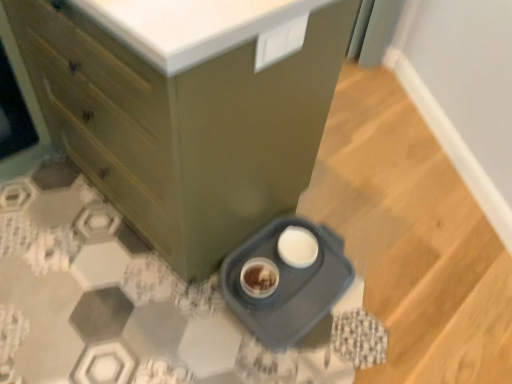
Locate an element on the screen. The image size is (512, 384). matte green cabinet at lower left is located at coordinates (187, 108).

The height and width of the screenshot is (384, 512). Describe the element at coordinates (187, 108) in the screenshot. I see `matte green cabinet at lower left` at that location.

This screenshot has width=512, height=384. What do you see at coordinates (287, 285) in the screenshot?
I see `gray plastic tray at lower center` at bounding box center [287, 285].

Where is `gray plastic tray at lower center`? This screenshot has width=512, height=384. gray plastic tray at lower center is located at coordinates (287, 285).

Measure the distance between point (321, 264) and camera.

The distance of point (321, 264) from camera is 1.49 meters.

Where is `matte green cabinet at lower left`? The height and width of the screenshot is (384, 512). matte green cabinet at lower left is located at coordinates (187, 108).

Based on the photo, is gray plastic tray at lower center at the left side of matte green cabinet at lower left?

In fact, gray plastic tray at lower center is to the right of matte green cabinet at lower left.

Relative to matte green cabinet at lower left, is gray plastic tray at lower center in front or behind?

In the image, gray plastic tray at lower center appears behind matte green cabinet at lower left.

Which is closer, (332,284) or (242,156)?

The point (242,156) is closer.

From the image's perspective, is gray plastic tray at lower center located beneath matte green cabinet at lower left?

Correct, gray plastic tray at lower center appears lower than matte green cabinet at lower left in the image.

From a real-world perspective, which object rests below the other?

From a 3D spatial view, gray plastic tray at lower center is below.

Looking at their sizes, would you say gray plastic tray at lower center is wider or thinner than matte green cabinet at lower left?

gray plastic tray at lower center is thinner than matte green cabinet at lower left.

In the scene shown: Considering the relative sizes of gray plastic tray at lower center and matte green cabinet at lower left in the image provided, is gray plastic tray at lower center taller than matte green cabinet at lower left?

Incorrect, the height of gray plastic tray at lower center is not larger of that of matte green cabinet at lower left.

Does gray plastic tray at lower center have a smaller size compared to matte green cabinet at lower left?

Indeed, gray plastic tray at lower center has a smaller size compared to matte green cabinet at lower left.

Could matte green cabinet at lower left be considered to be inside gray plastic tray at lower center?

Actually, matte green cabinet at lower left is outside gray plastic tray at lower center.

Is gray plastic tray at lower center not near matte green cabinet at lower left?

No, gray plastic tray at lower center is in close proximity to matte green cabinet at lower left.

Is gray plastic tray at lower center looking in the opposite direction of matte green cabinet at lower left?

Correct, gray plastic tray at lower center is looking away from matte green cabinet at lower left.

How many degrees apart are the facing directions of gray plastic tray at lower center and matte green cabinet at lower left?

The facing directions of gray plastic tray at lower center and matte green cabinet at lower left are 90.3 degrees apart.

Measure the distance between gray plastic tray at lower center and matte green cabinet at lower left.

gray plastic tray at lower center and matte green cabinet at lower left are 17.88 inches apart from each other.

Find the location of a particular element. This screenshot has width=512, height=384. appliance that appears behind the matte green cabinet at lower left is located at coordinates (287, 285).

Which is more to the right, matte green cabinet at lower left or gray plastic tray at lower center?

gray plastic tray at lower center is more to the right.

Does matte green cabinet at lower left come behind gray plastic tray at lower center?

No, it is not.

Is point (283, 127) more distant than point (293, 220)?

That is False.

From the picture: From the image's perspective, which is above, matte green cabinet at lower left or gray plastic tray at lower center?

matte green cabinet at lower left, from the image's perspective.

From a real-world perspective, who is located higher, matte green cabinet at lower left or gray plastic tray at lower center?

matte green cabinet at lower left, from a real-world perspective.

Considering the relative sizes of matte green cabinet at lower left and gray plastic tray at lower center in the image provided, is matte green cabinet at lower left wider than gray plastic tray at lower center?

Correct, the width of matte green cabinet at lower left exceeds that of gray plastic tray at lower center.

Between matte green cabinet at lower left and gray plastic tray at lower center, which one has more height?

With more height is matte green cabinet at lower left.

Considering the sizes of objects matte green cabinet at lower left and gray plastic tray at lower center in the image provided, who is smaller, matte green cabinet at lower left or gray plastic tray at lower center?

With smaller size is gray plastic tray at lower center.

Does matte green cabinet at lower left contain gray plastic tray at lower center?

No.

Is matte green cabinet at lower left directly adjacent to gray plastic tray at lower center?

No, matte green cabinet at lower left is not touching gray plastic tray at lower center.

Is matte green cabinet at lower left looking in the opposite direction of gray plastic tray at lower center?

No, matte green cabinet at lower left is not facing away from gray plastic tray at lower center.

Can you tell me how much matte green cabinet at lower left and gray plastic tray at lower center differ in facing direction?

The angle between the facing direction of matte green cabinet at lower left and the facing direction of gray plastic tray at lower center is 90.3 degrees.

I want to click on chest of drawers in front of the gray plastic tray at lower center, so click(x=187, y=108).

At what (x,y) coordinates should I click in order to perform the action: click on the chest of drawers that is in front of the gray plastic tray at lower center. Please return your answer as a coordinate pair (x, y). Looking at the image, I should click on tap(187, 108).

This screenshot has width=512, height=384. Find the location of `the chest of drawers that appears above the gray plastic tray at lower center (from a real-world perspective)`. the chest of drawers that appears above the gray plastic tray at lower center (from a real-world perspective) is located at coordinates (187, 108).